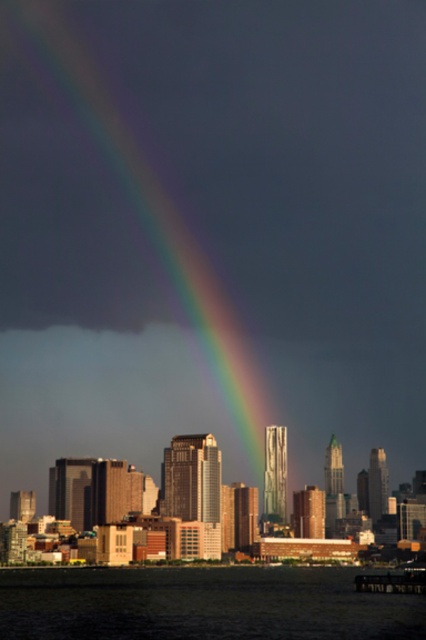
Who is shorter, rainbow at center or transparent water at lower center?

With less height is transparent water at lower center.

What are the coordinates of `rainbow at center` in the screenshot? It's located at (204, 230).

Who is more distant from viewer, (26, 230) or (132, 576)?

Point (26, 230)

The image size is (426, 640). I want to click on rainbow at center, so click(x=204, y=230).

Does transparent water at lower center appear on the right side of smooth glass skyscraper at center?

Indeed, transparent water at lower center is positioned on the right side of smooth glass skyscraper at center.

You are a GUI agent. You are given a task and a screenshot of the screen. Output one action in this format:
    pyautogui.click(x=<x>, y=<y>)
    Task: Click on the transparent water at lower center
    This screenshot has width=426, height=640.
    Given the screenshot: What is the action you would take?
    pyautogui.click(x=201, y=604)

Find the location of a particular element. Image resolution: width=426 pixels, height=640 pixels. transparent water at lower center is located at coordinates (201, 604).

Is rainbow at center smaller than smooth glass skyscraper at center?

Incorrect, rainbow at center is not smaller in size than smooth glass skyscraper at center.

Between point (187, 248) and point (104, 502), which one is positioned in front?

Point (187, 248) is more forward.

Image resolution: width=426 pixels, height=640 pixels. Find the location of `rainbow at center`. rainbow at center is located at coordinates (204, 230).